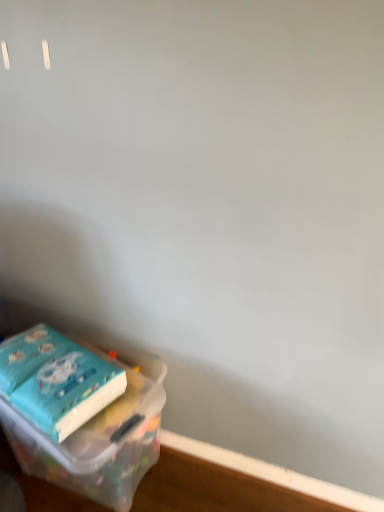
What do you see at coordinates (56, 380) in the screenshot? The height and width of the screenshot is (512, 384). I see `teal matte paper at lower left` at bounding box center [56, 380].

This screenshot has width=384, height=512. Identify the location of wooden at lower left. (272, 473).

Does teal matte paper at lower left have a larger size compared to wooden at lower left?

Indeed, teal matte paper at lower left has a larger size compared to wooden at lower left.

Is point (40, 404) in front of point (234, 466)?

Yes.

Which object is thinner, teal matte paper at lower left or wooden at lower left?

With smaller width is wooden at lower left.

From a real-world perspective, which is physically below, wooden at lower left or translucent plastic container at lower left?

From a 3D spatial view, wooden at lower left is below.

Is translucent plastic container at lower left at the back of wooden at lower left?

wooden at lower left is not turned away from translucent plastic container at lower left.

Is wooden at lower left far from translucent plastic container at lower left?

Actually, wooden at lower left and translucent plastic container at lower left are a little close together.

Is wooden at lower left to the left of translucent plastic container at lower left from the viewer's perspective?

Incorrect, wooden at lower left is not on the left side of translucent plastic container at lower left.

From the image's perspective, is wooden at lower left on top of teal matte paper at lower left?

No, from the image's perspective, wooden at lower left is not above teal matte paper at lower left.

Which of these two, wooden at lower left or teal matte paper at lower left, is thinner?

With smaller width is wooden at lower left.

Is the depth of wooden at lower left greater than that of teal matte paper at lower left?

Yes, wooden at lower left is further from the camera.

Is wooden at lower left facing towards teal matte paper at lower left?

No, wooden at lower left is not aimed at teal matte paper at lower left.

From the image's perspective, is translucent plastic container at lower left above or below wooden at lower left?

translucent plastic container at lower left is situated higher than wooden at lower left in the image.

What's the angular difference between translucent plastic container at lower left and wooden at lower left's facing directions?

The angular difference between translucent plastic container at lower left and wooden at lower left is 0.957 degrees.

Find the location of a particular element. box on the left side of wooden at lower left is located at coordinates (79, 415).

Does translucent plastic container at lower left have a greater height compared to wooden at lower left?

Indeed, translucent plastic container at lower left has a greater height compared to wooden at lower left.

Is translucent plastic container at lower left far away from teal matte paper at lower left?

translucent plastic container at lower left is actually quite close to teal matte paper at lower left.

Considering the positions of points (153, 444) and (69, 420), is point (153, 444) farther from camera compared to point (69, 420)?

Yes, point (153, 444) is behind point (69, 420).

Based on their sizes in the image, would you say translucent plastic container at lower left is bigger or smaller than teal matte paper at lower left?

translucent plastic container at lower left is bigger than teal matte paper at lower left.

I want to click on box to the right of teal matte paper at lower left, so click(x=79, y=415).

Is teal matte paper at lower left positioned far away from translucent plastic container at lower left?

That's not correct — teal matte paper at lower left is a little close to translucent plastic container at lower left.

Can you confirm if teal matte paper at lower left is thinner than translucent plastic container at lower left?

Correct, the width of teal matte paper at lower left is less than that of translucent plastic container at lower left.

Considering the points (64, 372) and (103, 459), which point is in front, point (64, 372) or point (103, 459)?

The point (64, 372) is in front.

Identify the location of paperback book above the translucent plastic container at lower left (from the image's perspective). The image size is (384, 512). (56, 380).

Image resolution: width=384 pixels, height=512 pixels. I want to click on paperback book that is above the wooden at lower left (from a real-world perspective), so tap(56, 380).

Identify the location of window sill that appears on the right of translucent plastic container at lower left. tap(272, 473).

Looking at the image, which one is located closer to translucent plastic container at lower left, wooden at lower left or teal matte paper at lower left?

Based on the image, teal matte paper at lower left appears to be nearer to translucent plastic container at lower left.

Based on their spatial positions, is translucent plastic container at lower left or teal matte paper at lower left further from wooden at lower left?

teal matte paper at lower left lies further to wooden at lower left than the other object.

Estimate the real-world distances between objects in this image. Which object is closer to teal matte paper at lower left, translucent plastic container at lower left or wooden at lower left?

Among the two, translucent plastic container at lower left is located nearer to teal matte paper at lower left.

Estimate the real-world distances between objects in this image. Which object is closer to teal matte paper at lower left, wooden at lower left or translucent plastic container at lower left?

translucent plastic container at lower left lies closer to teal matte paper at lower left than the other object.

Considering their positions, is teal matte paper at lower left positioned further to translucent plastic container at lower left than wooden at lower left?

wooden at lower left lies further to translucent plastic container at lower left than the other object.

Based on the photo, looking at the image, which one is located closer to wooden at lower left, teal matte paper at lower left or translucent plastic container at lower left?

translucent plastic container at lower left.

You are a GUI agent. You are given a task and a screenshot of the screen. Output one action in this format:
    pyautogui.click(x=<x>, y=<y>)
    Task: Click on the box between teal matte paper at lower left and wooden at lower left from left to right
    
    Given the screenshot: What is the action you would take?
    tap(79, 415)